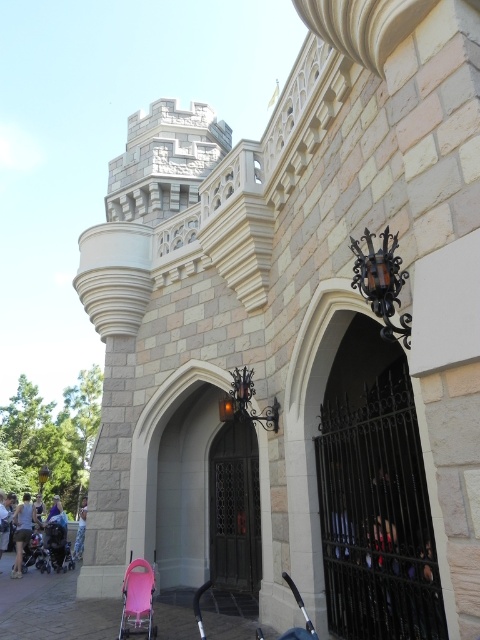
Question: Can you confirm if wooden gate at center is positioned below light blue denim shorts at lower left?

Choices:
 (A) yes
 (B) no

Answer: (B)

Question: Does matte black stroller at lower left appear under light blue denim shorts at lower left?

Choices:
 (A) no
 (B) yes

Answer: (A)

Question: Which is farther from the light blue denim shorts at lower left?

Choices:
 (A) pink fabric stroller at lower center
 (B) matte gray shorts at lower left
 (C) wooden gate at center
 (D) matte black stroller at lower left

Answer: (A)

Question: Which object appears farthest from the camera in this image?

Choices:
 (A) pink fabric stroller at lower center
 (B) matte gray shorts at lower left
 (C) wooden gate at center

Answer: (B)

Question: Which of the following is the farthest from the observer?

Choices:
 (A) (21, 522)
 (B) (63, 528)
 (C) (251, 584)

Answer: (B)

Question: Does wooden gate at center appear on the left side of matte gray shorts at lower left?

Choices:
 (A) yes
 (B) no

Answer: (B)